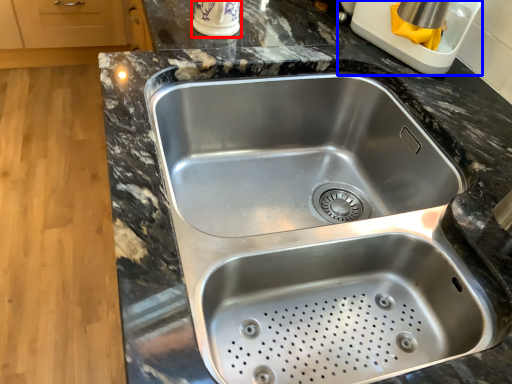
Question: Which of the following is the farthest to the observer, appliance (highlighted by a red box) or appliance (highlighted by a blue box)?

Choices:
 (A) appliance
 (B) appliance

Answer: (A)